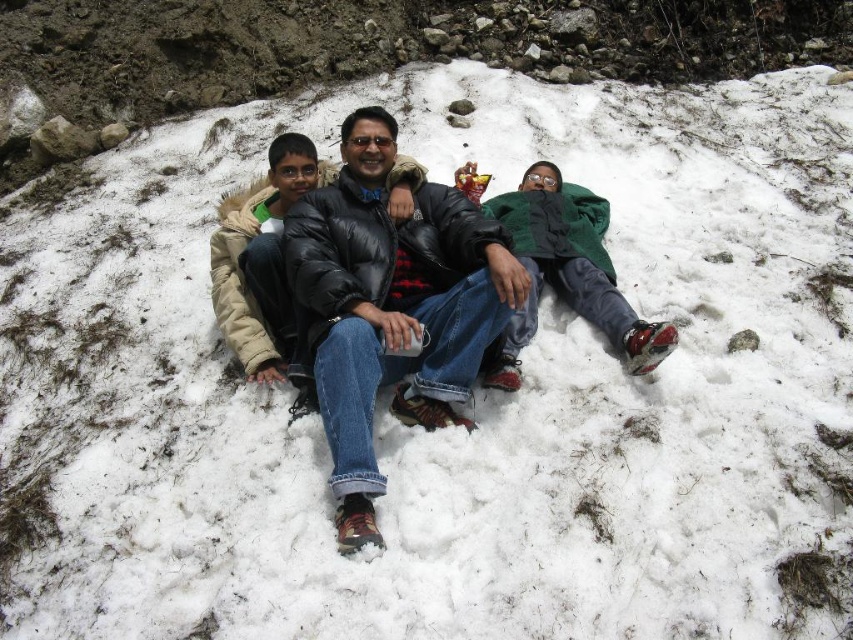
Who is lower down, matte black jacket at center or black puffer jacket at center?

matte black jacket at center is lower down.

Identify the location of matte black jacket at center. This screenshot has width=853, height=640. (392, 307).

Who is positioned more to the right, green matte jacket at center or black puffer jacket at center?

From the viewer's perspective, green matte jacket at center appears more on the right side.

Does green matte jacket at center have a lesser width compared to black puffer jacket at center?

Incorrect, green matte jacket at center's width is not less than black puffer jacket at center's.

Is point (540, 211) in front of point (309, 141)?

No, it is behind (309, 141).

Locate an element on the screen. The height and width of the screenshot is (640, 853). green matte jacket at center is located at coordinates (567, 272).

Which is more to the left, matte black jacket at center or green matte jacket at center?

From the viewer's perspective, matte black jacket at center appears more on the left side.

Who is positioned more to the right, matte black jacket at center or green matte jacket at center?

green matte jacket at center

Describe the element at coordinates (392, 307) in the screenshot. This screenshot has width=853, height=640. I see `matte black jacket at center` at that location.

Find the location of a particular element. The image size is (853, 640). matte black jacket at center is located at coordinates (392, 307).